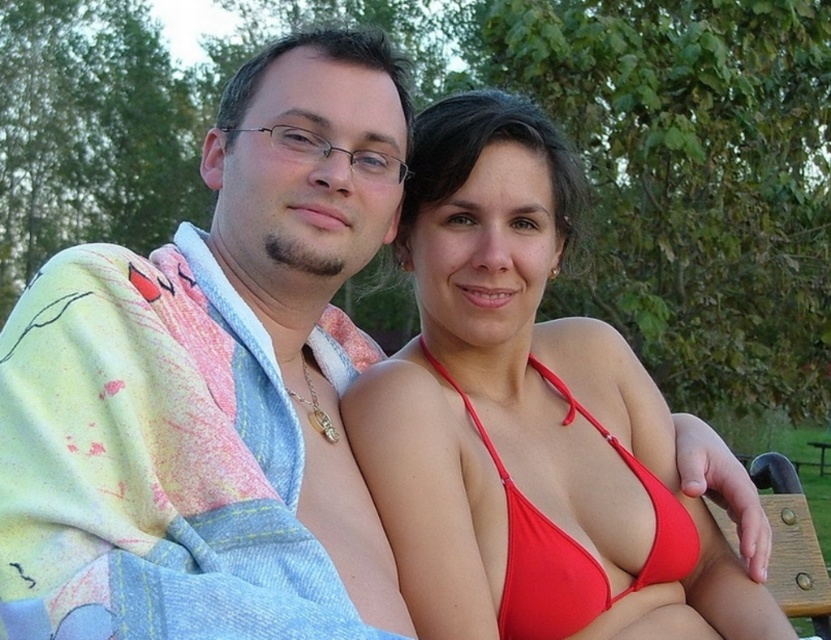
Is multicolored tie-dye robe at left shorter than red matte bikini top at center?

No.

Which is more to the right, multicolored tie-dye robe at left or red matte bikini top at center?

red matte bikini top at center is more to the right.

Is point (243, 406) closer to camera compared to point (686, 536)?

Yes, point (243, 406) is in front of point (686, 536).

Where is `multicolored tie-dye robe at left`? This screenshot has width=831, height=640. multicolored tie-dye robe at left is located at coordinates (153, 460).